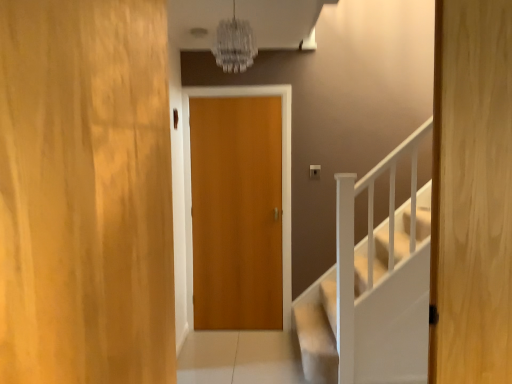
Question: Is point (496, 19) positioned closer to the camera than point (260, 107)?

Choices:
 (A) closer
 (B) farther

Answer: (A)

Question: From a real-world perspective, relative to wooden door at center, the second door in the right-to-left sequence, is wooden door at center, which is the 1th door from right to left, vertically above or below?

Choices:
 (A) below
 (B) above

Answer: (B)

Question: Which object is positioned farthest from the wooden door at center, marked as the 3th door in a back-to-front arrangement?

Choices:
 (A) wooden door at center, which is the 1th door from right to left
 (B) wooden door at center, which is the first door in back-to-front order

Answer: (B)

Question: Estimate the real-world distances between objects in this image. Which object is farther from the wooden door at center, the 3th door in the left-to-right sequence?

Choices:
 (A) wooden door at center, the second door in the right-to-left sequence
 (B) wooden door at center, which is the third door in right-to-left order

Answer: (A)